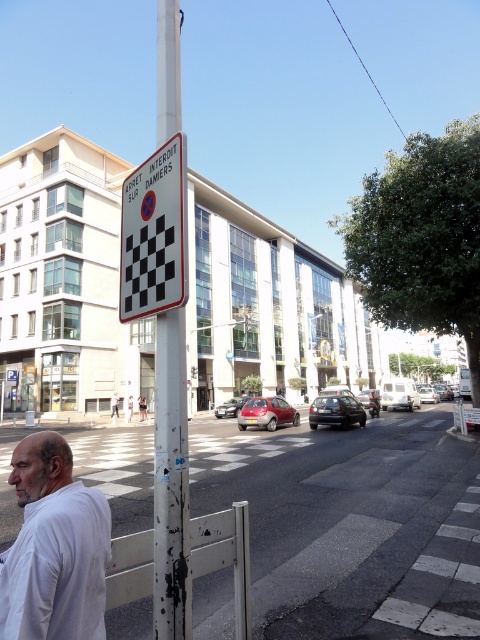
Question: Is white matte shirt at lower left to the left of white painted metal pole at center from the viewer's perspective?

Choices:
 (A) yes
 (B) no

Answer: (B)

Question: Does white matte shirt at lower left appear on the right side of white plastic sign at upper center?

Choices:
 (A) yes
 (B) no

Answer: (A)

Question: Is white matte shirt at lower left to the left of white plastic sign at upper center from the viewer's perspective?

Choices:
 (A) no
 (B) yes

Answer: (A)

Question: Which object appears farthest from the camera in this image?

Choices:
 (A) white painted metal pole at center
 (B) white matte shirt at lower left
 (C) white plastic sign at upper center

Answer: (C)

Question: Which point is closer to the camera?

Choices:
 (A) white painted metal pole at center
 (B) white matte shirt at lower left
 (C) white plastic sign at upper center

Answer: (B)

Question: Which of the following is the farthest from the observer?

Choices:
 (A) (20, 612)
 (B) (124, 212)

Answer: (B)